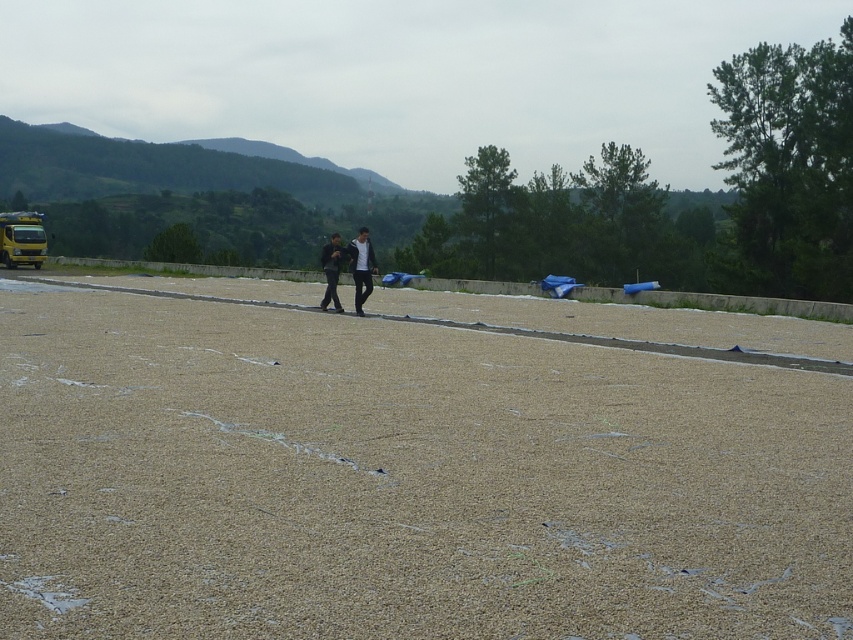
Can you confirm if yellow metallic school bus at left is bigger than black matte jacket at center?

No, yellow metallic school bus at left is not bigger than black matte jacket at center.

Can you confirm if yellow metallic school bus at left is positioned above black matte jacket at center?

Actually, yellow metallic school bus at left is below black matte jacket at center.

Identify the location of yellow metallic school bus at left. This screenshot has width=853, height=640. (21, 237).

Is point (561, 621) closer to viewer compared to point (329, 250)?

That is True.

Is point (532, 433) more distant than point (335, 282)?

No, (532, 433) is in front of (335, 282).

Locate an element on the screen. The image size is (853, 640). brown gravel at center is located at coordinates (403, 481).

Who is positioned more to the right, dark gray fabric at center or yellow metallic school bus at left?

From the viewer's perspective, dark gray fabric at center appears more on the right side.

Does dark gray fabric at center have a smaller size compared to yellow metallic school bus at left?

Incorrect, dark gray fabric at center is not smaller in size than yellow metallic school bus at left.

Locate an element on the screen. Image resolution: width=853 pixels, height=640 pixels. dark gray fabric at center is located at coordinates (349, 268).